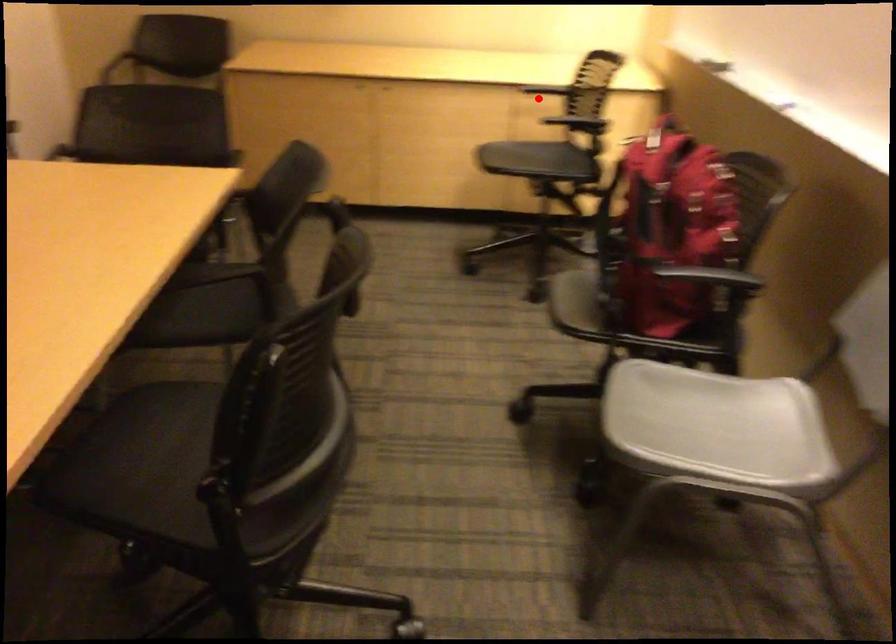
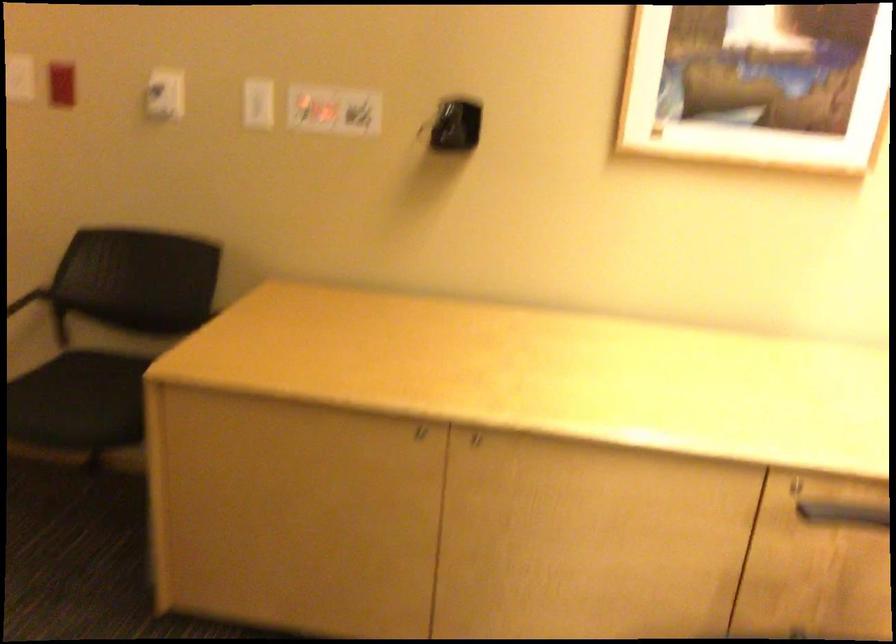
Where in the second image is the point corresponding to the highlighted location from the first image?

(828, 507)